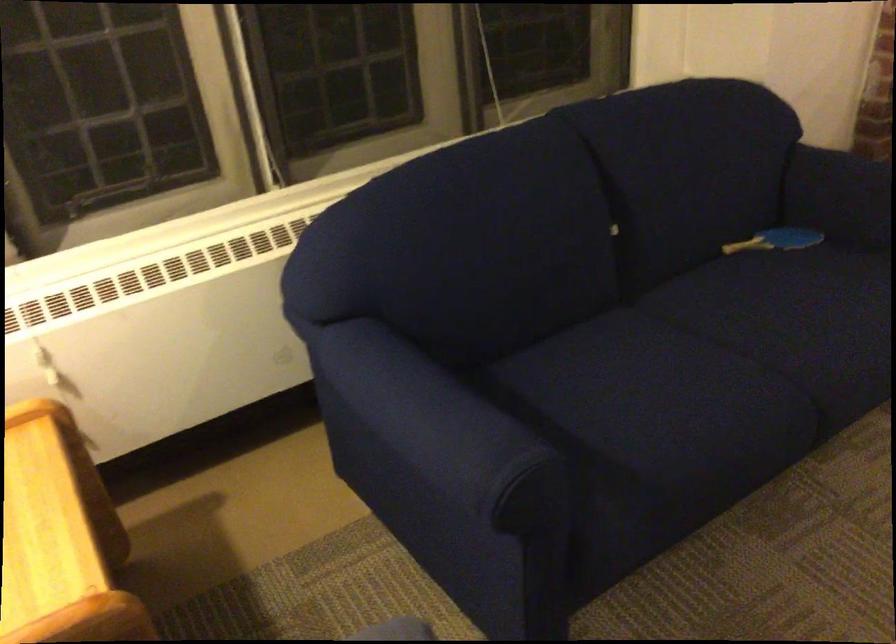
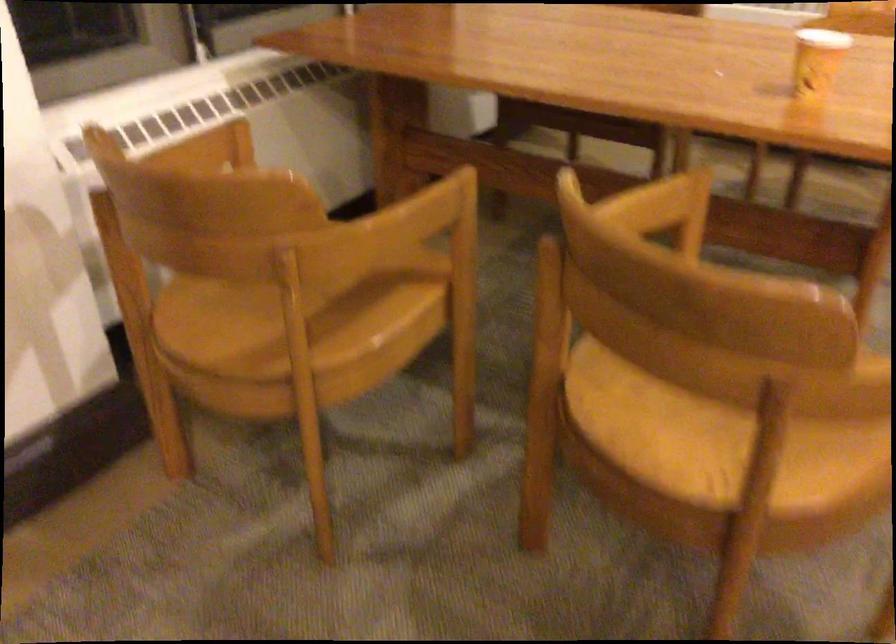
In a continuous first-person perspective shot, in which direction is the camera moving?

The movement direction of the cameraman is right, forward.